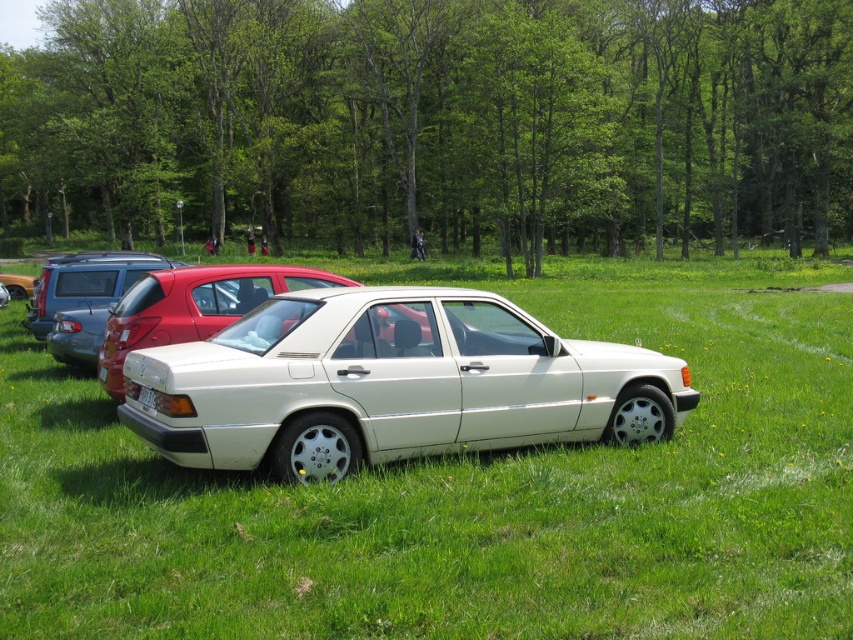
You are a delivery person trying to reach the white plastic license plate at center. There is a matte black hatchback at left blocking your path. Can you walk around it without getting too close? Please explain.

The matte black hatchback at left is 8.95 meters away from the white plastic license plate at center. Since the hatchback is parked, you can easily walk around it to reach the license plate as long as you maintain a safe distance of at least 1 meter from the vehicle.

You are a parking attendant trying to locate a car. You see the white glossy sedan at center and the white plastic license plate at center. Which one is positioned higher?

The white glossy sedan at center is above the white plastic license plate at center, so the white glossy sedan at center is positioned higher.

You are standing at point A located at coordinates 0.5, 0.5 in the image. You want to walk towards the white glossy sedan at center. In which direction should you move from your current position?

Since the white glossy sedan at center is located at coordinates (x=469, y=490), which is to the right and slightly below your current position at (x=426, y=320), you should move towards the right and slightly downward direction to reach it.